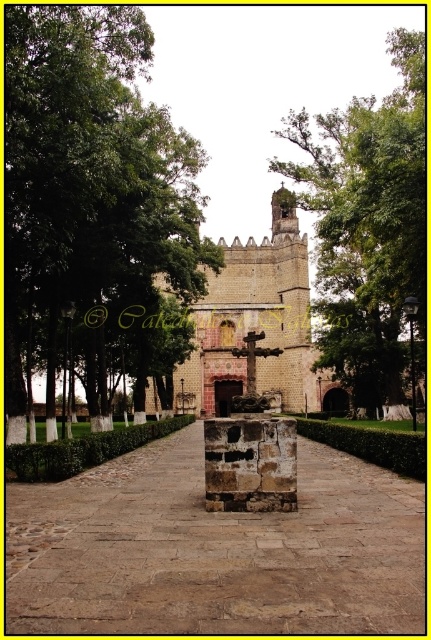
In the scene shown: You are standing in front of the stone church with the large stone cross in the foreground. You notice a point marked at coordinates (88, 179). What object is located at this point?

The green leafy tree at upper left is located at point (88, 179).

You are standing at the entrance of the church and want to take a photo of the green leafy tree at upper left. Which direction should you face to capture it in your camera?

The green leafy tree at upper left is located at point coordinates of (88,179), so you should face towards the upper left direction to capture it in your camera.